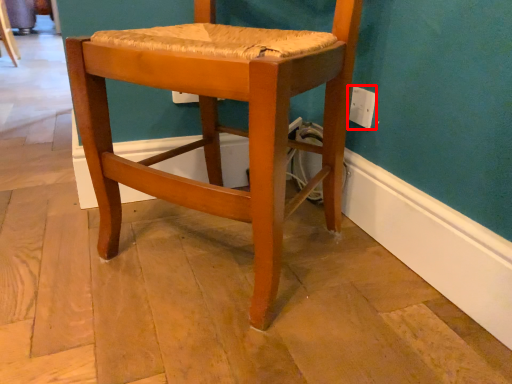
Question: From the image's perspective, considering the relative positions of electric outlet (annotated by the red box) and chair in the image provided, where is electric outlet (annotated by the red box) located with respect to the staircase?

Choices:
 (A) above
 (B) below

Answer: (A)